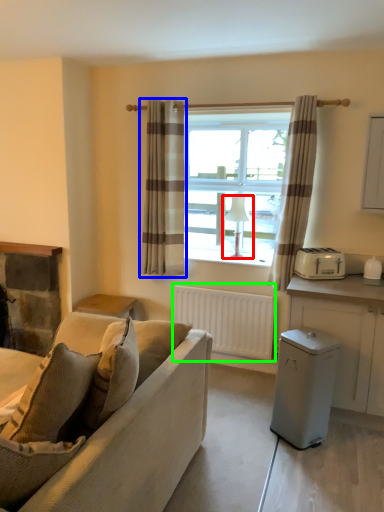
Question: Which object is positioned farthest from lamp (highlighted by a red box)? Select from curtain (highlighted by a blue box) and radiator (highlighted by a green box).

Choices:
 (A) curtain
 (B) radiator

Answer: (A)